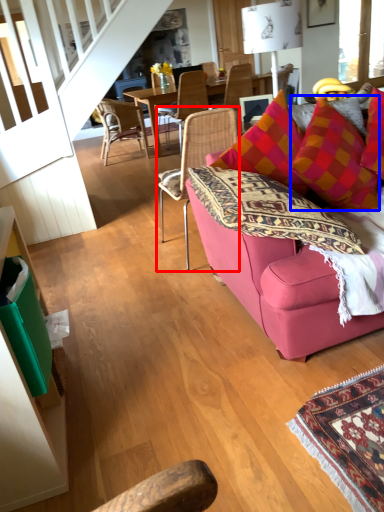
Question: Among these objects, which one is nearest to the camera, chair (highlighted by a red box) or throw pillow (highlighted by a blue box)?

Choices:
 (A) chair
 (B) throw pillow

Answer: (B)